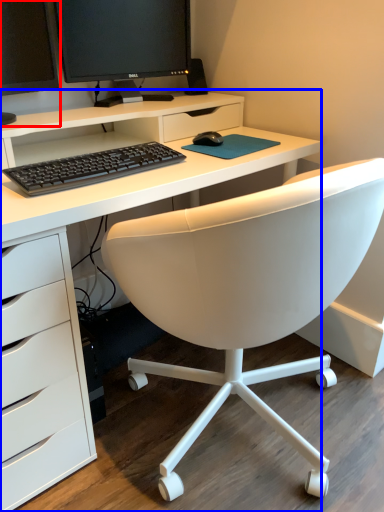
Question: Which object appears farthest to the camera in this image, computer monitor (highlighted by a red box) or desk (highlighted by a blue box)?

Choices:
 (A) computer monitor
 (B) desk

Answer: (A)